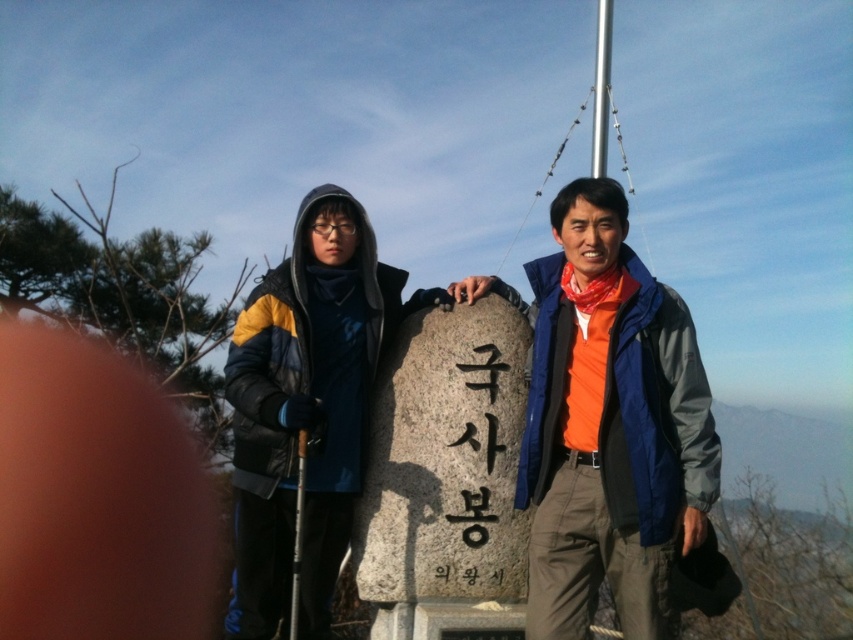
You are a hiker who needs to place a 30 inch long hiking pole between the orange fabric scarf at center and the gray stone at center. Can you fit the pole between them without bending it?

The orange fabric scarf at center is 36.20 inches from the gray stone at center. Since the pole is 30 inches long, it can fit between them without bending.

You are planning to hang a small decoration from the metallic pole at upper center. Can you hang it directly above the orange fabric scarf at center without any obstruction?

The orange fabric scarf at center is positioned under the metallic pole at upper center, so yes, you can hang the decoration directly above it without any obstruction.